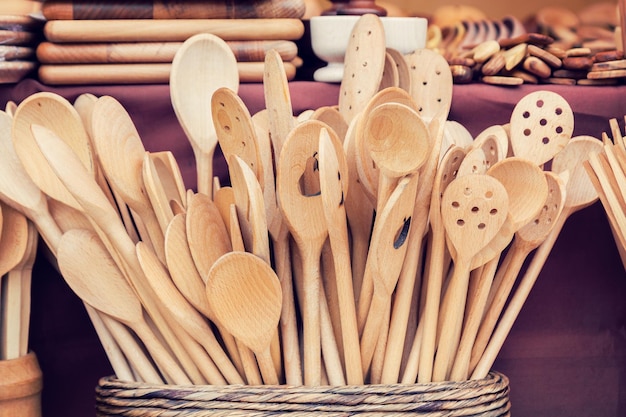
Where is `bowl`? This screenshot has width=626, height=417. bowl is located at coordinates (332, 27).